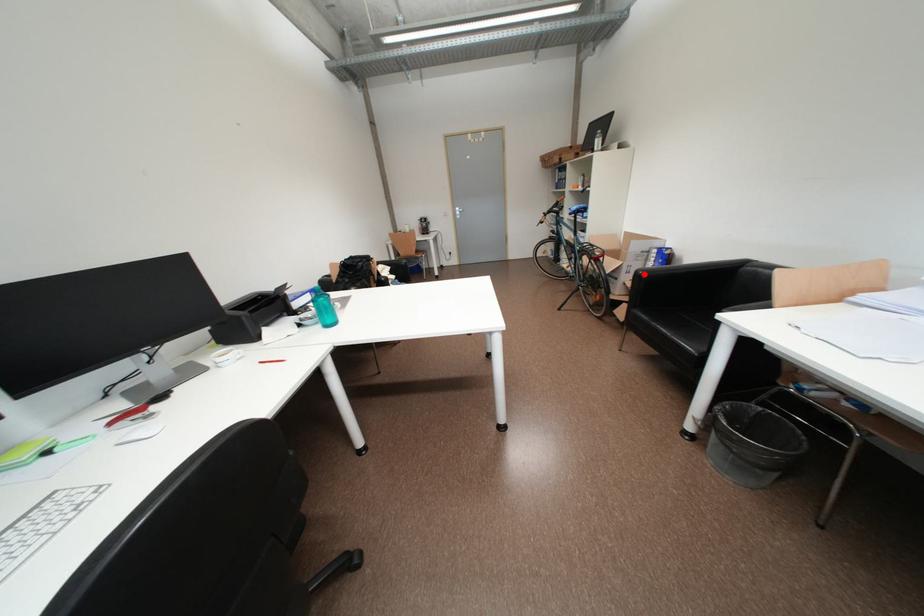
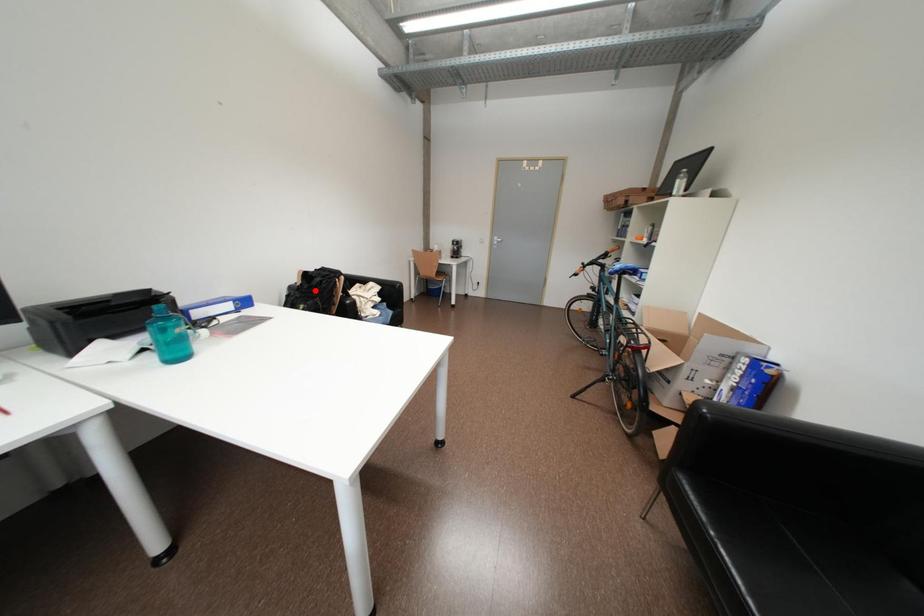
I am providing you with two images of the same scene from different viewpoints. A red point is marked on the first image and another point is marked on the second image. Are the points marked in image1 and image2 representing the same 3D position?

No